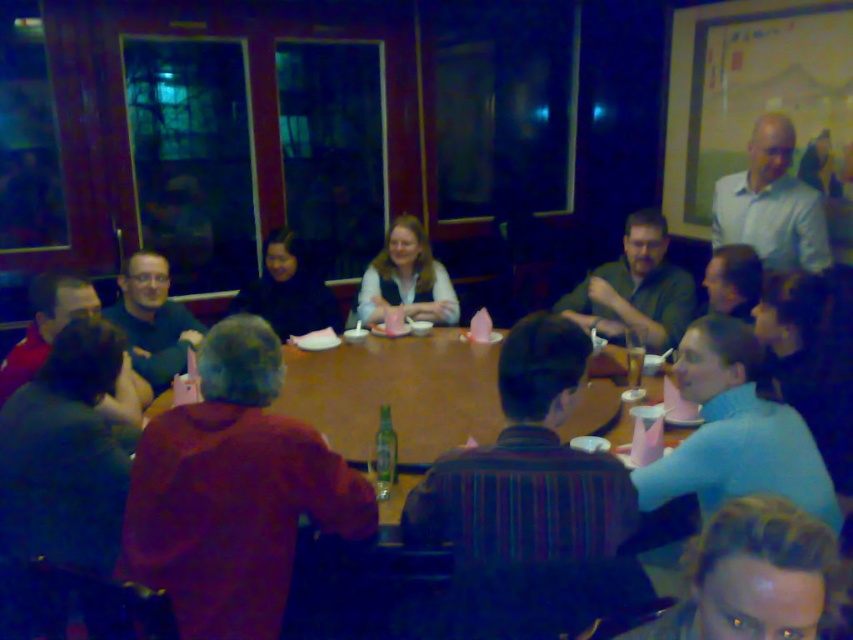
You are a waiter in a restaurant and need to place a new dish between the two points on the table. The first point is at coordinate point (x=776, y=252) and the second is at point (x=45, y=308). Which point is closer to you so you can place the dish there?

Point (x=45, y=308) is closer to you than point (x=776, y=252), so you should place the dish there.

You are a server at a restaurant and need to place a new drink order on the table. The drink must be placed exactly 6 feet away from the green glass bottle at center. Can you place it on the table without moving any other items?

The green glass bottle at center is 6.37 feet away from the viewer. Since the required distance is 6 feet, which is slightly closer than the current position of the bottle, the server can place the new drink order approximately 0.37 feet closer to the bottle than its current position to meet the 6 feet requirement.

You are a waiter in a restaurant and need to serve drinks to the group. You have a green glass bottle at center and a translucent glass beer at center on the table. Which one should you pick if you need to serve the smaller drink container?

The green glass bottle at center has a smaller size compared to the translucent glass beer at center, so you should pick the green glass bottle at center to serve the smaller drink container.